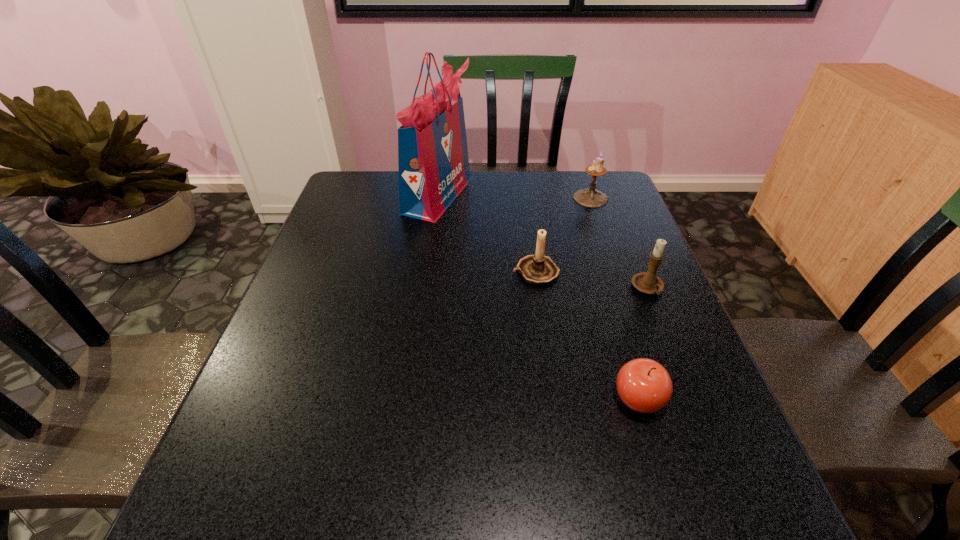
This screenshot has height=540, width=960. Find the location of `candle holder identified as the closest to the farthest candle holder`. candle holder identified as the closest to the farthest candle holder is located at coordinates (537, 269).

You are a GUI agent. You are given a task and a screenshot of the screen. Output one action in this format:
    pyautogui.click(x=<x>, y=<y>)
    Task: Click on the vacant space that satisfies the following two spatial constraints: 1. on the front-facing side of the leftmost candle holder; 2. on the left side of the tallest object
    This screenshot has width=960, height=540.
    Given the screenshot: What is the action you would take?
    pyautogui.click(x=428, y=271)

The height and width of the screenshot is (540, 960). I want to click on vacant point that satisfies the following two spatial constraints: 1. on the front-facing side of the fourth object from right to left; 2. on the left side of the grocery bag, so click(428, 271).

At what (x,y) coordinates should I click in order to perform the action: click on blank area in the image that satisfies the following two spatial constraints: 1. on the front-facing side of the shortest object; 2. on the left side of the leftmost object. Please return your answer as a coordinate pair (x, y). Looking at the image, I should click on (411, 399).

I want to click on free point that satisfies the following two spatial constraints: 1. on the front-facing side of the leftmost object; 2. on the right side of the farthest candle holder, so pyautogui.click(x=438, y=198).

The height and width of the screenshot is (540, 960). Find the location of `vacant space that satisfies the following two spatial constraints: 1. on the front-facing side of the leftmost object; 2. on the back side of the leftmost candle holder`. vacant space that satisfies the following two spatial constraints: 1. on the front-facing side of the leftmost object; 2. on the back side of the leftmost candle holder is located at coordinates (428, 271).

Locate an element on the screen. free point that satisfies the following two spatial constraints: 1. on the front-facing side of the leftmost object; 2. on the back side of the farthest candle holder is located at coordinates (438, 198).

At what (x,y) coordinates should I click in order to perform the action: click on free space that satisfies the following two spatial constraints: 1. on the back side of the farthest candle holder; 2. on the left side of the leftmost candle holder. Please return your answer as a coordinate pair (x, y). Looking at the image, I should click on (525, 198).